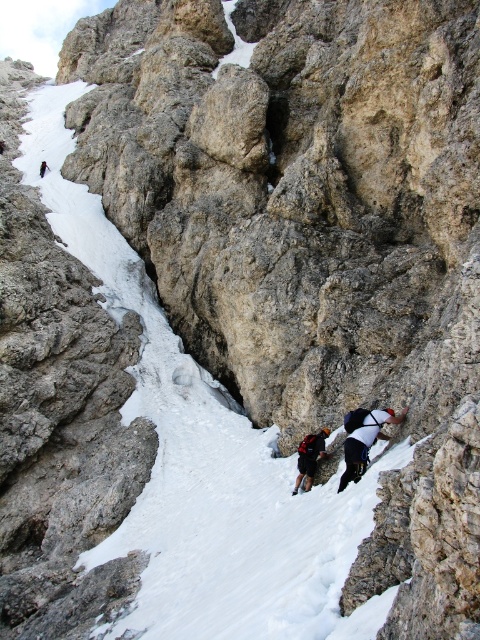
You are a mountain rescue team member assessing the distance between the white fabric climbing harness at right and the dark gray fabric backpack at center. Given that your rescue rope is 3 meters long, can you safely retrieve the backpack from the harness location without moving the harness?

The white fabric climbing harness at right and dark gray fabric backpack at center are 3.46 meters apart. Since the rescue rope is only 3 meters long, it is not long enough to safely reach the backpack from the harness location without moving the harness.

You are a mountain guide assessing the climbing gear placement in the scene. Which object is positioned closer to the climbers? The white fabric climbing harness at right or the dark gray fabric backpack at center?

The white fabric climbing harness at right is closer to the viewer than the dark gray fabric backpack at center, so it is positioned closer to the climbers.

You are a mountain rescue team member assessing the gear of two climbers in the image. You need to determine which piece of gear is larger in size between the white fabric climbing harness at right and the dark gray fabric backpack at center. Based on the scene, which one is bigger?

The white fabric climbing harness at right is bigger than the dark gray fabric backpack at center according to the description.